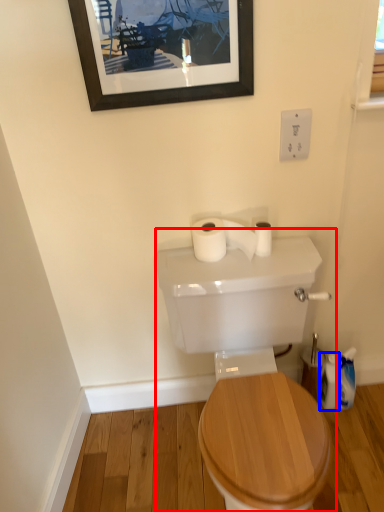
Question: Among these objects, which one is nearest to the camera, sink (highlighted by a red box) or toiletry (highlighted by a blue box)?

Choices:
 (A) sink
 (B) toiletry

Answer: (A)